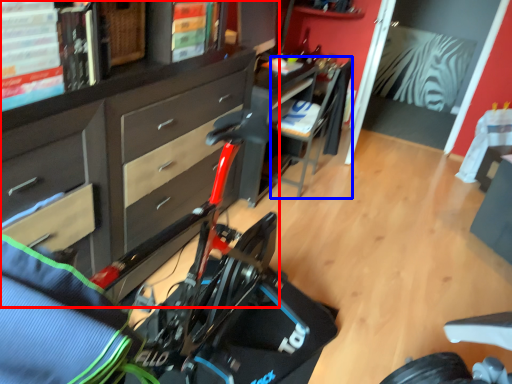
Question: Which object appears farthest to the camera in this image, cabinetry (highlighted by a red box) or chair (highlighted by a blue box)?

Choices:
 (A) cabinetry
 (B) chair

Answer: (B)